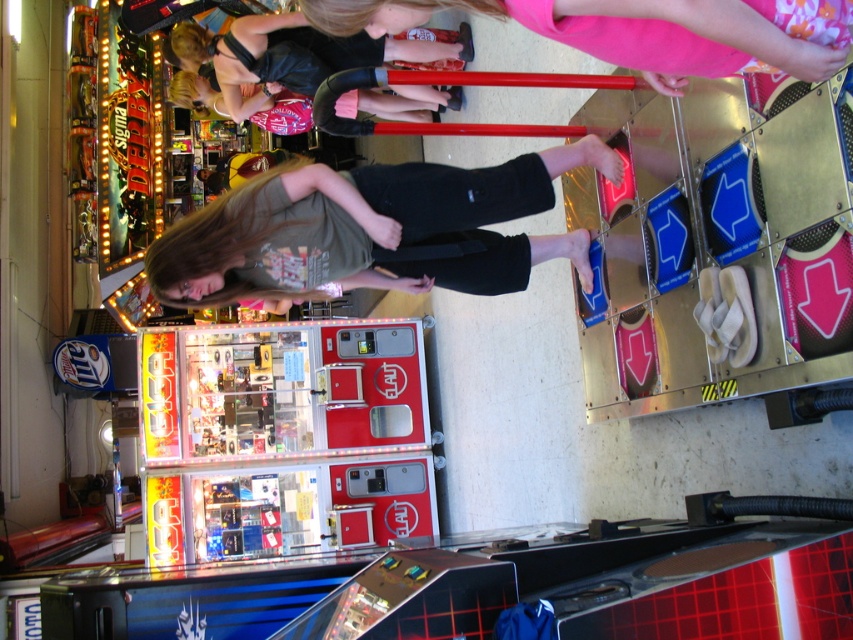
You are standing in the arcade and see both the green cotton shirt at center and the black leather jacket at upper center. Which one would you need to look towards first if you want to greet the person wearing them?

You should look towards the green cotton shirt at center first because it is closer to you than the black leather jacket at upper center.

You are a photographer trying to capture a photo of the green cotton shirt at center and the black leather jacket at upper center. Since you want both subjects to appear equally large in the photo, which one should you move closer to the camera?

The green cotton shirt at center has a lesser width compared to the black leather jacket at upper center. To make them appear equally large in the photo, you should move the green cotton shirt at center closer to the camera since it is narrower and requires less distance adjustment to balance their sizes.